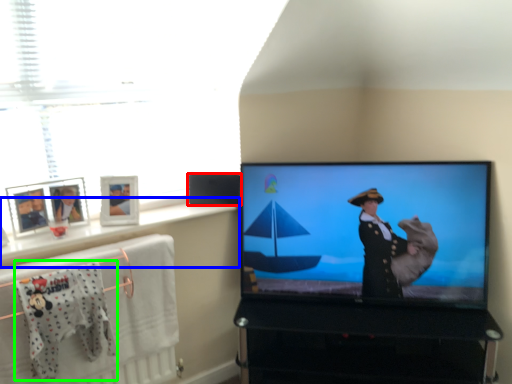
Question: Considering the real-world distances, which object is closest to speaker (highlighted by a red box)? window sill (highlighted by a blue box) or baby clothe (highlighted by a green box).

Choices:
 (A) window sill
 (B) baby clothe

Answer: (A)